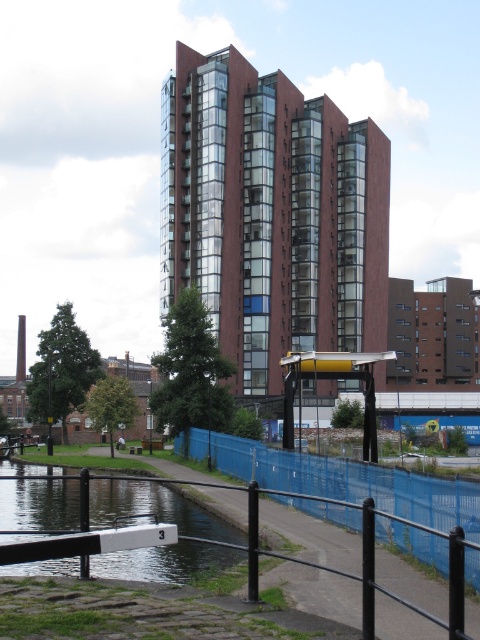
Who is more forward, (420, 547) or (142, 451)?

Point (420, 547)

Is blue plastic fence at lower center further to camera compared to wooden park bench at center?

No, blue plastic fence at lower center is closer to the viewer.

What are the coordinates of `blue plastic fence at lower center` in the screenshot? It's located at (352, 483).

Where is `blue plastic fence at lower center`? blue plastic fence at lower center is located at coordinates (352, 483).

Who is more forward, (262, 122) or (220, 550)?

Point (220, 550) is in front.

Is red brick building at center bigger than smooth concrete river at lower left?

Correct, red brick building at center is larger in size than smooth concrete river at lower left.

What are the coordinates of `red brick building at center` in the screenshot? It's located at (271, 216).

Does smooth concrete river at lower left appear on the left side of wooden park bench at center?

Incorrect, smooth concrete river at lower left is not on the left side of wooden park bench at center.

Locate an element on the screen. smooth concrete river at lower left is located at coordinates (154, 509).

Locate an element on the screen. The width and height of the screenshot is (480, 640). smooth concrete river at lower left is located at coordinates (154, 509).